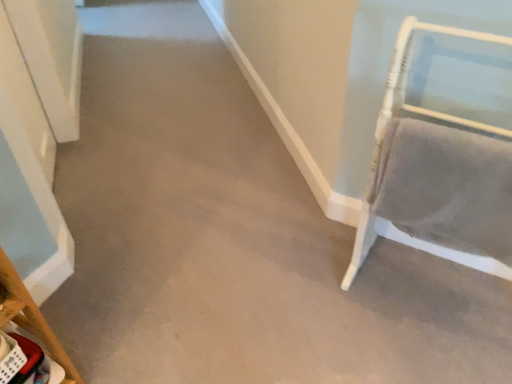
Question: Can you confirm if wooden chair at lower left, the 1th furniture in the left-to-right sequence, is smaller than velvet gray chair at right, acting as the first furniture starting from the right?

Choices:
 (A) yes
 (B) no

Answer: (A)

Question: Considering the relative sizes of wooden chair at lower left, the 1th furniture in the left-to-right sequence, and velvet gray chair at right, which is the second furniture in left-to-right order, in the image provided, is wooden chair at lower left, the 1th furniture in the left-to-right sequence, taller than velvet gray chair at right, which is the second furniture in left-to-right order,?

Choices:
 (A) yes
 (B) no

Answer: (B)

Question: From a real-world perspective, is wooden chair at lower left, the second furniture positioned from the right, over velvet gray chair at right, acting as the first furniture starting from the right?

Choices:
 (A) no
 (B) yes

Answer: (A)

Question: From the image's perspective, would you say wooden chair at lower left, the second furniture positioned from the right, is shown under velvet gray chair at right, acting as the first furniture starting from the right?

Choices:
 (A) yes
 (B) no

Answer: (A)

Question: Does wooden chair at lower left, the 1th furniture in the left-to-right sequence, have a lesser width compared to velvet gray chair at right, which is the second furniture in left-to-right order?

Choices:
 (A) no
 (B) yes

Answer: (B)

Question: From the image's perspective, is wooden chair at lower left, the second furniture positioned from the right, located above velvet gray chair at right, acting as the first furniture starting from the right?

Choices:
 (A) yes
 (B) no

Answer: (B)

Question: Is velvet gray chair at right, acting as the first furniture starting from the right, at the left side of wooden chair at lower left, the 1th furniture in the left-to-right sequence?

Choices:
 (A) no
 (B) yes

Answer: (A)

Question: Could you tell me if velvet gray chair at right, which is the second furniture in left-to-right order, is facing wooden chair at lower left, the 1th furniture in the left-to-right sequence?

Choices:
 (A) no
 (B) yes

Answer: (A)

Question: Considering the relative sizes of velvet gray chair at right, acting as the first furniture starting from the right, and wooden chair at lower left, the 1th furniture in the left-to-right sequence, in the image provided, is velvet gray chair at right, acting as the first furniture starting from the right, smaller than wooden chair at lower left, the 1th furniture in the left-to-right sequence,?

Choices:
 (A) no
 (B) yes

Answer: (A)

Question: Can you confirm if velvet gray chair at right, acting as the first furniture starting from the right, is bigger than wooden chair at lower left, the 1th furniture in the left-to-right sequence?

Choices:
 (A) no
 (B) yes

Answer: (B)

Question: Considering the relative sizes of velvet gray chair at right, which is the second furniture in left-to-right order, and wooden chair at lower left, the second furniture positioned from the right, in the image provided, is velvet gray chair at right, which is the second furniture in left-to-right order, shorter than wooden chair at lower left, the second furniture positioned from the right,?

Choices:
 (A) no
 (B) yes

Answer: (A)

Question: Is velvet gray chair at right, which is the second furniture in left-to-right order, in contact with wooden chair at lower left, the second furniture positioned from the right?

Choices:
 (A) yes
 (B) no

Answer: (B)

Question: From a real-world perspective, is velvet gray chair at right, acting as the first furniture starting from the right, positioned above or below wooden chair at lower left, the 1th furniture in the left-to-right sequence?

Choices:
 (A) above
 (B) below

Answer: (A)